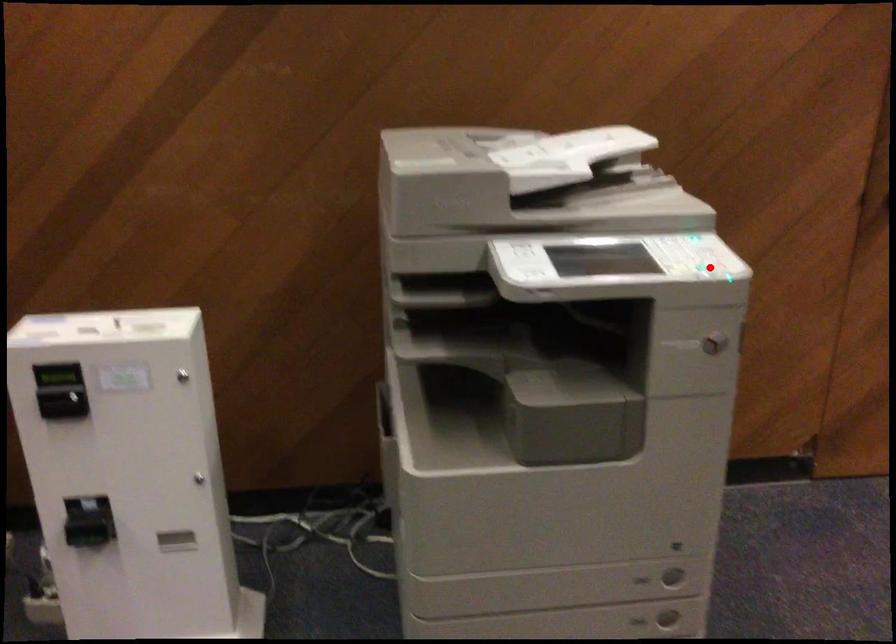
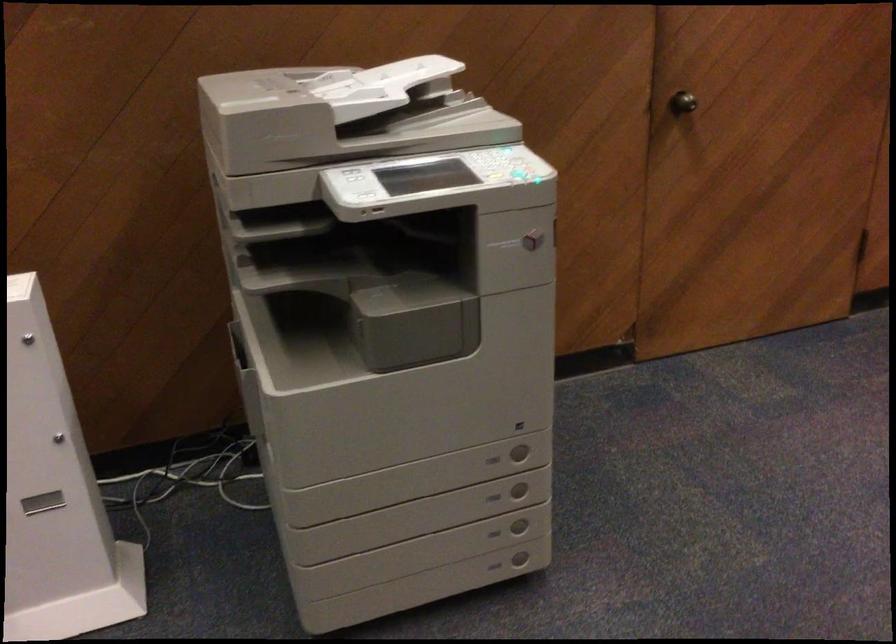
Question: I am providing you with two images of the same scene from different viewpoints. Given a red point in image1, look at the same physical point in image2. Is it:

Choices:
 (A) Closer to the viewpoint
 (B) Farther from the viewpoint

Answer: (B)